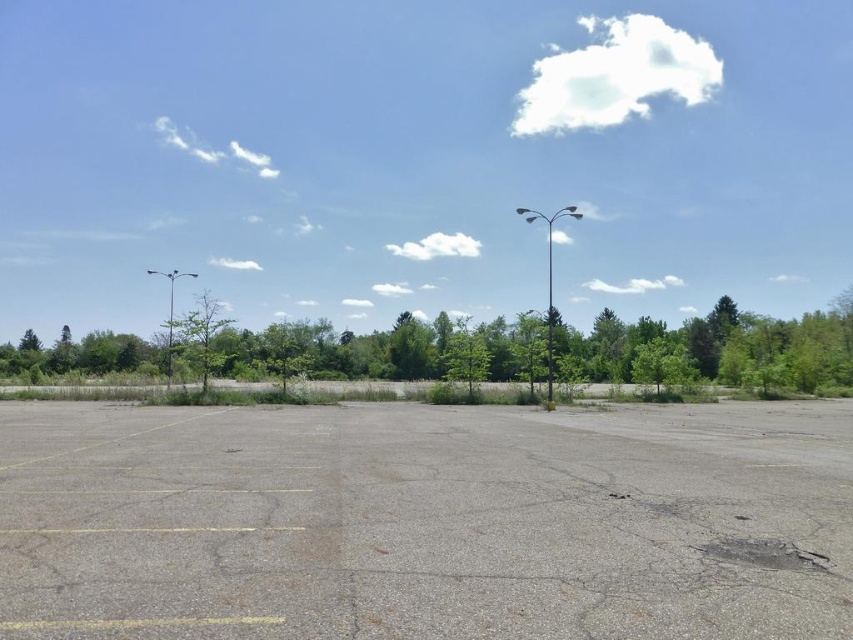
Based on the photo, you are standing at the origin point of the coordinate system in the image. You want to walk to the gray asphalt parking lot at center. Which direction should you move in?

The gray asphalt parking lot at center is located at coordinate point (x=426, y=522), so you should move towards the right direction from your current position at the origin to reach it.

You are standing in the parking lot and want to reach the green leafy tree at center. The parking lot has a speed limit of 15 km per hour. If you walk at a steady pace of 4 km per hour, how long will it take you to reach the tree?

The distance to the green leafy tree at center is 38.00 meters. Walking at 4 km per hour, it would take approximately 5.7 minutes to cover 38 meters. Since the parking lot has a speed limit of 15 km per hour, which is higher than your walking speed, you can safely walk towards the tree at your current pace.

You are standing in the parking lot and want to walk from the point at coordinates point (173, 554) to the point at coordinates point (67, 360). Which direction should you face to walk towards the second point?

You should face towards the lower left direction because point (67, 360) is further away from the camera compared to point (173, 554), meaning it is located lower and to the left in the parking lot.